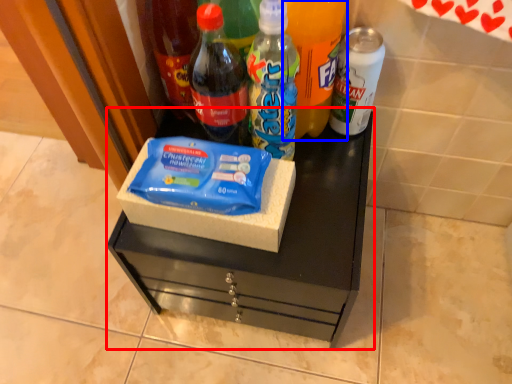
Question: Which object is closer to the camera taking this photo, vanity (highlighted by a red box) or bottle (highlighted by a blue box)?

Choices:
 (A) vanity
 (B) bottle

Answer: (B)